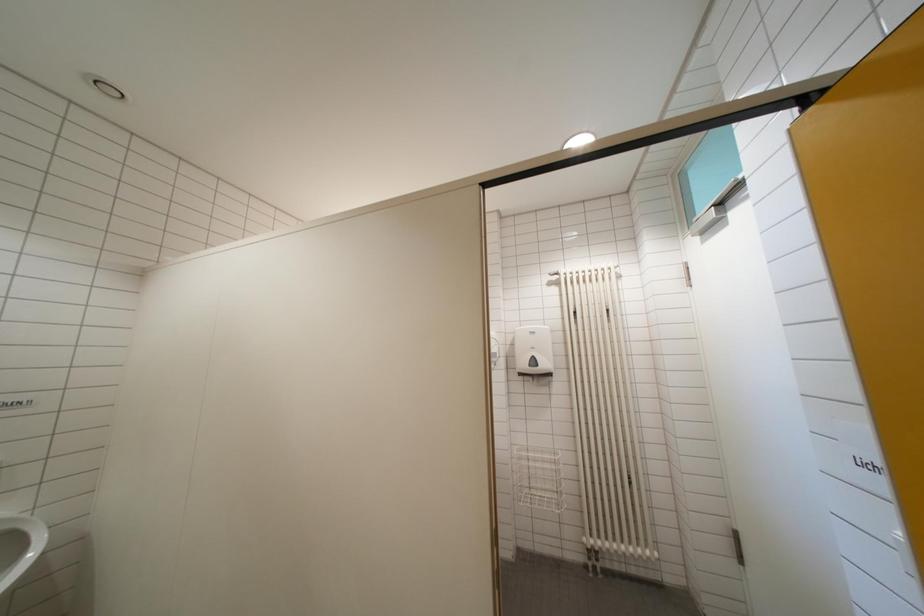
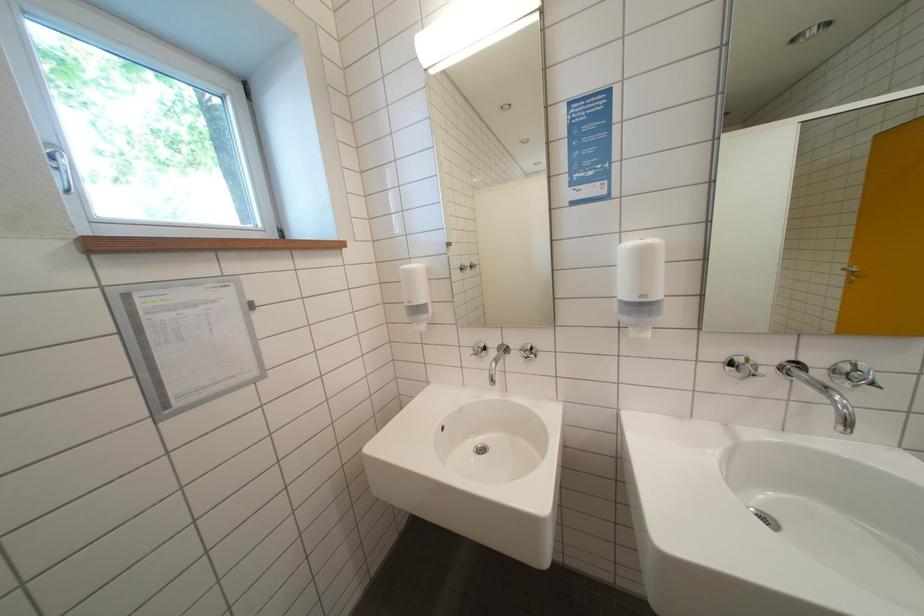
In a continuous first-person perspective shot, in which direction is the camera moving?

A: The cameraman moved toward left, forward.